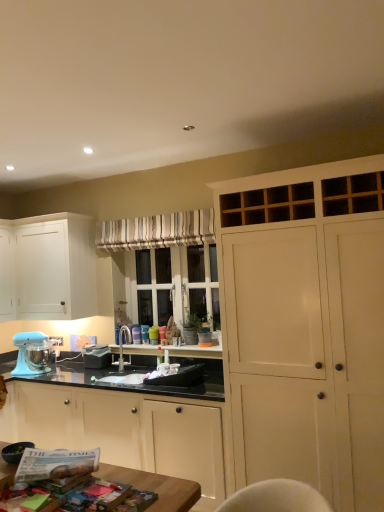
The height and width of the screenshot is (512, 384). I want to click on matte black coffee maker at center, so click(97, 357).

The image size is (384, 512). What do you see at coordinates (48, 267) in the screenshot? I see `white matte cabinet at left, acting as the 1th cabinetry starting from the left` at bounding box center [48, 267].

The height and width of the screenshot is (512, 384). I want to click on matte white cabinet at center, which is counted as the second cabinetry, starting from the right, so click(x=126, y=423).

What do you see at coordinates (306, 328) in the screenshot? This screenshot has width=384, height=512. I see `white wood cabinet at right, which appears as the 3th cabinetry when viewed from the left` at bounding box center [306, 328].

Where is `white wood cabinet at right, which appears as the 3th cabinetry when viewed from the left`? white wood cabinet at right, which appears as the 3th cabinetry when viewed from the left is located at coordinates (306, 328).

This screenshot has height=512, width=384. I want to click on striped fabric curtain at center, so click(158, 231).

This screenshot has height=512, width=384. Describe the element at coordinates (27, 353) in the screenshot. I see `matte blue mixer at lower left` at that location.

Where is `matte black coffee maker at center`? Image resolution: width=384 pixels, height=512 pixels. matte black coffee maker at center is located at coordinates (97, 357).

In terms of height, does matte black coffee maker at center look taller or shorter compared to white matte cabinet at left, which is counted as the 3th cabinetry, starting from the right?

Clearly, matte black coffee maker at center is shorter compared to white matte cabinet at left, which is counted as the 3th cabinetry, starting from the right.

Is matte black coffee maker at center to the left of white matte cabinet at left, which is counted as the 3th cabinetry, starting from the right, from the viewer's perspective?

No.

Is matte black coffee maker at center in contact with white matte cabinet at left, which is counted as the 3th cabinetry, starting from the right?

No, matte black coffee maker at center is not with white matte cabinet at left, which is counted as the 3th cabinetry, starting from the right.

In the scene shown: From the image's perspective, which is above, matte black coffee maker at center or white matte cabinet at left, acting as the 1th cabinetry starting from the left?

white matte cabinet at left, acting as the 1th cabinetry starting from the left.

From the image's perspective, which object appears higher, matte black coffee maker at center or white wood cabinet at right, which appears as the 3th cabinetry when viewed from the left?

white wood cabinet at right, which appears as the 3th cabinetry when viewed from the left, appears higher in the image.

Would you say matte black coffee maker at center is to the left or to the right of white wood cabinet at right, which appears as the first cabinetry when viewed from the right, in the picture?

matte black coffee maker at center is to the left of white wood cabinet at right, which appears as the first cabinetry when viewed from the right.

Could you tell me if matte black coffee maker at center is turned towards white wood cabinet at right, which appears as the 3th cabinetry when viewed from the left?

No, matte black coffee maker at center does not turn towards white wood cabinet at right, which appears as the 3th cabinetry when viewed from the left.

Is matte blue mixer at lower left not inside matte black coffee maker at center?

Absolutely, matte blue mixer at lower left is external to matte black coffee maker at center.

Considering the positions of point (23, 356) and point (94, 358), is point (23, 356) closer or farther from the camera than point (94, 358)?

Clearly, point (23, 356) is closer to the camera than point (94, 358).

Consider the image. Is matte blue mixer at lower left placed right next to matte black coffee maker at center?

matte blue mixer at lower left is not next to matte black coffee maker at center, and they're not touching.

From the image's perspective, is matte blue mixer at lower left beneath matte black coffee maker at center?

Actually, matte blue mixer at lower left appears above matte black coffee maker at center in the image.

Considering the positions of objects white matte cabinet at left, acting as the 1th cabinetry starting from the left, and striped fabric curtain at center in the image provided, who is in front, white matte cabinet at left, acting as the 1th cabinetry starting from the left, or striped fabric curtain at center?

Positioned in front is striped fabric curtain at center.

From the image's perspective, is white matte cabinet at left, acting as the 1th cabinetry starting from the left, located above or below striped fabric curtain at center?

Based on their image positions, white matte cabinet at left, acting as the 1th cabinetry starting from the left, is located beneath striped fabric curtain at center.

From the image's perspective, starting from the striped fabric curtain at center, which cabinetry is the 1st one below? Please provide its 2D coordinates.

[(48, 267)]

In the scene shown: What's the angular difference between white matte cabinet at left, acting as the 1th cabinetry starting from the left, and striped fabric curtain at center's facing directions?

white matte cabinet at left, acting as the 1th cabinetry starting from the left, and striped fabric curtain at center are facing 0.698 degrees away from each other.

Looking at this image, are white wood cabinet at right, which appears as the 3th cabinetry when viewed from the left, and matte white cabinet at center, the 2th cabinetry from the left, beside each other?

white wood cabinet at right, which appears as the 3th cabinetry when viewed from the left, is not next to matte white cabinet at center, the 2th cabinetry from the left, and they're not touching.

Considering the positions of point (331, 269) and point (176, 415), is point (331, 269) closer or farther from the camera than point (176, 415)?

Clearly, point (331, 269) is closer to the camera than point (176, 415).

Considering the positions of objects white wood cabinet at right, which appears as the 3th cabinetry when viewed from the left, and matte white cabinet at center, which is counted as the second cabinetry, starting from the right, in the image provided, who is more to the right, white wood cabinet at right, which appears as the 3th cabinetry when viewed from the left, or matte white cabinet at center, which is counted as the second cabinetry, starting from the right,?

Positioned to the right is white wood cabinet at right, which appears as the 3th cabinetry when viewed from the left.

Is white matte cabinet at left, which is counted as the 3th cabinetry, starting from the right, surrounding matte white cabinet at center, which is counted as the second cabinetry, starting from the right?

No, white matte cabinet at left, which is counted as the 3th cabinetry, starting from the right, does not contain matte white cabinet at center, which is counted as the second cabinetry, starting from the right.

In order to click on cabinetry lying behind the matte white cabinet at center, the 2th cabinetry from the left in this screenshot , I will do `click(48, 267)`.

Would you say white matte cabinet at left, which is counted as the 3th cabinetry, starting from the right, is a long distance from matte white cabinet at center, which is counted as the second cabinetry, starting from the right?

Yes, white matte cabinet at left, which is counted as the 3th cabinetry, starting from the right, is far from matte white cabinet at center, which is counted as the second cabinetry, starting from the right.

Looking at this image, considering the sizes of objects white matte cabinet at left, acting as the 1th cabinetry starting from the left, and matte black coffee maker at center in the image provided, who is smaller, white matte cabinet at left, acting as the 1th cabinetry starting from the left, or matte black coffee maker at center?

Smaller between the two is matte black coffee maker at center.

What are the coordinates of `cabinetry lying on the left of matte black coffee maker at center` in the screenshot? It's located at (48, 267).

Is white matte cabinet at left, acting as the 1th cabinetry starting from the left, outside of matte black coffee maker at center?

Yes, white matte cabinet at left, acting as the 1th cabinetry starting from the left, is not within matte black coffee maker at center.

Image resolution: width=384 pixels, height=512 pixels. What are the coordinates of `cabinetry that is the 2nd one when counting upward from the matte black coffee maker at center (from the image's perspective)` in the screenshot? It's located at (48, 267).

The image size is (384, 512). Identify the location of kitchen appliance located below the white wood cabinet at right, which appears as the first cabinetry when viewed from the right (from the image's perspective). (97, 357).

Looking at the image, which one is located closer to matte blue mixer at lower left, matte black coffee maker at center or satin nickel faucet at center?

The object closer to matte blue mixer at lower left is matte black coffee maker at center.

Considering their positions, is matte white cabinet at center, which is counted as the second cabinetry, starting from the right, positioned further to striped fabric curtain at center than white matte cabinet at left, which is counted as the 3th cabinetry, starting from the right?

Among the two, matte white cabinet at center, which is counted as the second cabinetry, starting from the right, is located further to striped fabric curtain at center.

When comparing their distances from matte black coffee maker at center, does satin nickel faucet at center or striped fabric curtain at center seem further?

striped fabric curtain at center lies further to matte black coffee maker at center than the other object.

Considering their positions, is matte black coffee maker at center positioned closer to white wood cabinet at right, which appears as the first cabinetry when viewed from the right, than matte blue mixer at lower left?

Based on the image, matte black coffee maker at center appears to be nearer to white wood cabinet at right, which appears as the first cabinetry when viewed from the right.

Based on their spatial positions, is striped fabric curtain at center or white matte cabinet at left, which is counted as the 3th cabinetry, starting from the right, further from matte white cabinet at center, the 2th cabinetry from the left?

Among the two, striped fabric curtain at center is located further to matte white cabinet at center, the 2th cabinetry from the left.

Which object lies further to the anchor point matte blue mixer at lower left, striped fabric curtain at center or white matte cabinet at left, which is counted as the 3th cabinetry, starting from the right?

Among the two, striped fabric curtain at center is located further to matte blue mixer at lower left.

From the image, which object appears to be nearer to striped fabric curtain at center, white matte cabinet at left, which is counted as the 3th cabinetry, starting from the right, or white wood cabinet at right, which appears as the first cabinetry when viewed from the right?

white matte cabinet at left, which is counted as the 3th cabinetry, starting from the right, is closer to striped fabric curtain at center.

Considering their positions, is matte black coffee maker at center positioned closer to satin nickel faucet at center than matte white cabinet at center, which is counted as the second cabinetry, starting from the right?

matte black coffee maker at center is closer to satin nickel faucet at center.

You are a GUI agent. You are given a task and a screenshot of the screen. Output one action in this format:
    pyautogui.click(x=<x>, y=<y>)
    Task: Click on the sink between matte white cabinet at center, which is counted as the second cabinetry, starting from the right, and matte black coffee maker at center, along the z-axis
    
    Given the screenshot: What is the action you would take?
    pyautogui.click(x=123, y=366)

The width and height of the screenshot is (384, 512). In order to click on sink between white matte cabinet at left, which is counted as the 3th cabinetry, starting from the right, and striped fabric curtain at center from left to right in this screenshot , I will do [123, 366].

The image size is (384, 512). In order to click on sink situated between matte blue mixer at lower left and white wood cabinet at right, which appears as the 3th cabinetry when viewed from the left, from left to right in this screenshot , I will do `click(123, 366)`.

Where is `home appliance between white matte cabinet at left, which is counted as the 3th cabinetry, starting from the right, and striped fabric curtain at center`? The height and width of the screenshot is (512, 384). home appliance between white matte cabinet at left, which is counted as the 3th cabinetry, starting from the right, and striped fabric curtain at center is located at coordinates (27, 353).